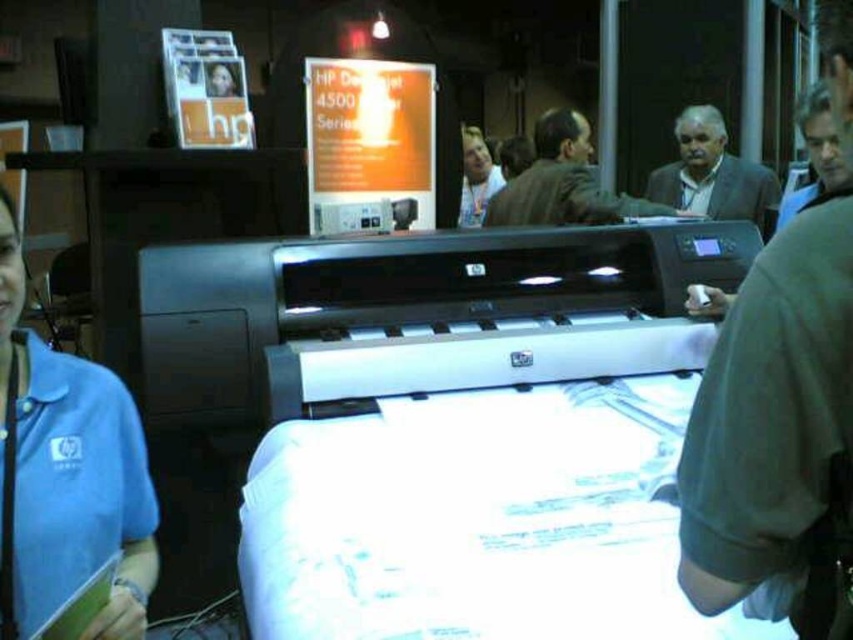
You are an event organizer planning to move the satin silver printer at center and the gray suit jacket at upper right to a different location. Which object requires more space in terms of width when moving?

The satin silver printer at center might be wider than gray suit jacket at upper right, so it likely requires more space in terms of width when moving.

You are at a trade show and see a point marked at coordinates [419,312]. Based on the scene, can you determine what object this point is located on?

The point at coordinates [419,312] is located on the satin silver printer at center.

You are an attendee at the exhibition and want to approach the HP DesignJet 4500 Series printer. There are two people blocking your path. One is wearing a dark gray shirt at center and the other a blue fabric shirt at left. Which person should you move around to get to the printer?

The dark gray shirt at center is in front of the blue fabric shirt at left, so you should move around the dark gray shirt at center to reach the printer first.